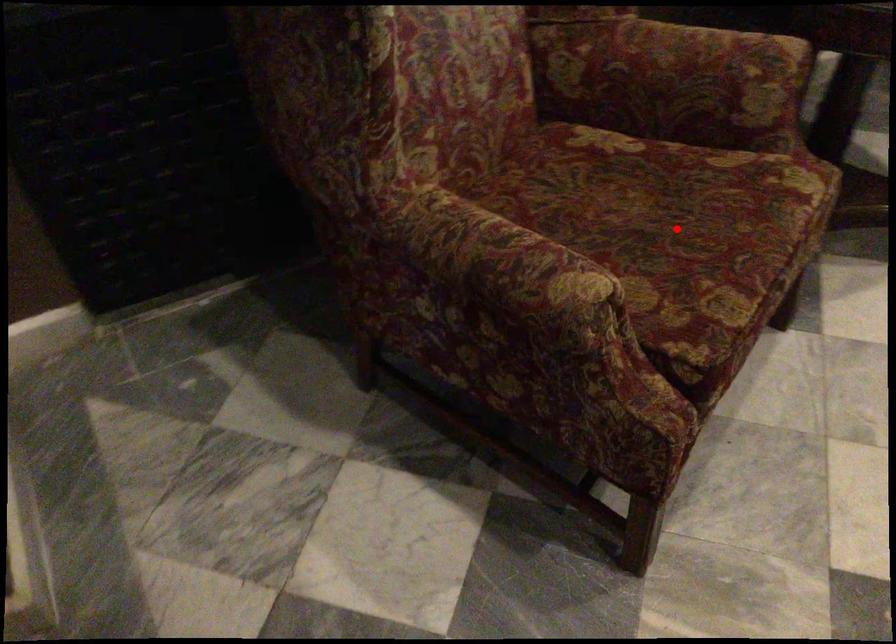
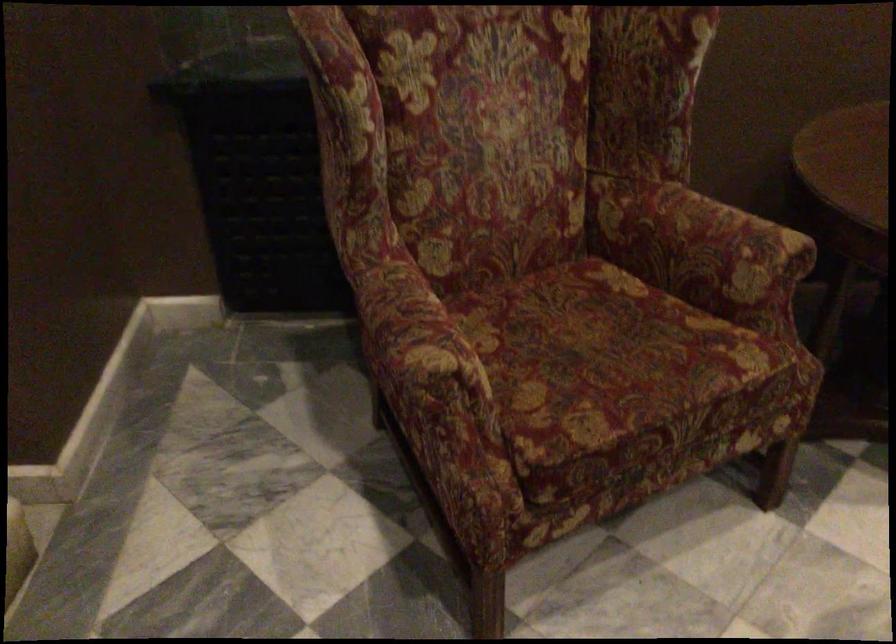
Where in the second image is the point corresponding to the highlighted location from the first image?

(606, 361)